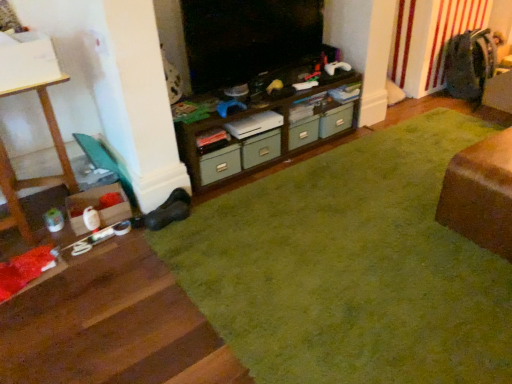
This screenshot has height=384, width=512. What are the coordinates of `free spot to the left of brown wood table at lower right` in the screenshot? It's located at (407, 218).